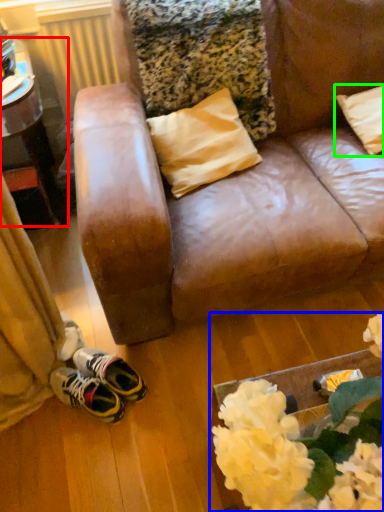
Question: Considering the real-world distances, which object is farthest from table (highlighted by a red box)? floral arrangement (highlighted by a blue box) or pillow (highlighted by a green box)?

Choices:
 (A) floral arrangement
 (B) pillow

Answer: (A)